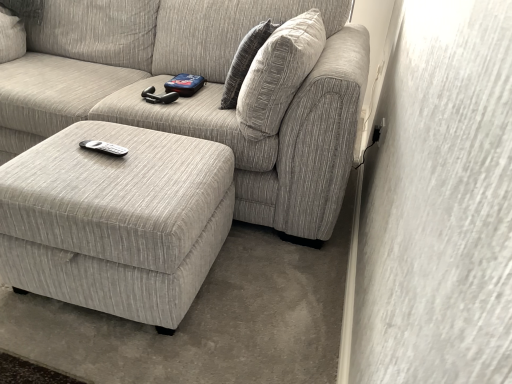
Question: Would you say textured gray pillow at upper right is inside or outside matte gray ottoman at lower left?

Choices:
 (A) inside
 (B) outside

Answer: (B)

Question: Is textured gray pillow at upper right taller or shorter than matte gray ottoman at lower left?

Choices:
 (A) tall
 (B) short

Answer: (A)

Question: Which object is positioned farthest from the matte gray ottoman at lower left?

Choices:
 (A) textured beige couch at center
 (B) textured gray pillow at upper right

Answer: (B)

Question: Which is nearer to the textured gray pillow at upper right?

Choices:
 (A) textured beige couch at center
 (B) matte gray ottoman at lower left

Answer: (A)